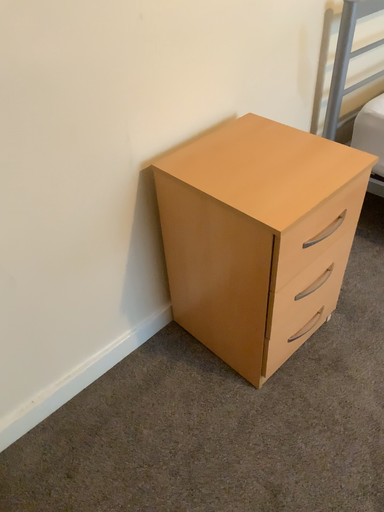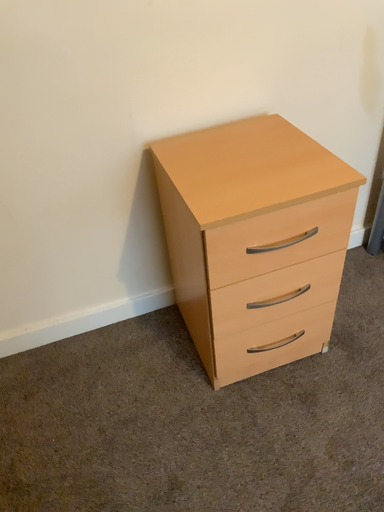
Question: Which way did the camera rotate in the video?

Choices:
 (A) rotated right
 (B) rotated left

Answer: (B)